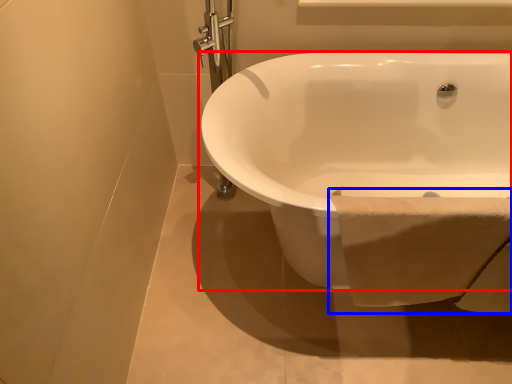
Question: Which of the following is the farthest to the observer, bathtub (highlighted by a red box) or toilet paper (highlighted by a blue box)?

Choices:
 (A) bathtub
 (B) toilet paper

Answer: (B)